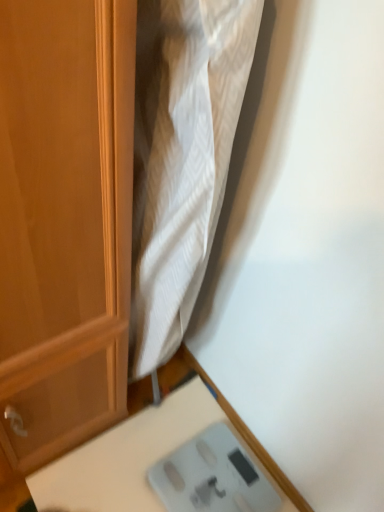
Question: From a real-world perspective, does white plastic scale at lower right sit lower than gray plastic scale at lower right?

Choices:
 (A) yes
 (B) no

Answer: (B)

Question: Is white plastic scale at lower right shorter than gray plastic scale at lower right?

Choices:
 (A) yes
 (B) no

Answer: (B)

Question: Can we say white plastic scale at lower right lies outside gray plastic scale at lower right?

Choices:
 (A) no
 (B) yes

Answer: (B)

Question: From the image's perspective, is white plastic scale at lower right located above gray plastic scale at lower right?

Choices:
 (A) yes
 (B) no

Answer: (B)

Question: Can you confirm if white plastic scale at lower right is wider than gray plastic scale at lower right?

Choices:
 (A) yes
 (B) no

Answer: (A)

Question: Considering the relative sizes of white plastic scale at lower right and gray plastic scale at lower right in the image provided, is white plastic scale at lower right thinner than gray plastic scale at lower right?

Choices:
 (A) yes
 (B) no

Answer: (B)

Question: Is gray plastic scale at lower right turned away from white plastic scale at lower right?

Choices:
 (A) yes
 (B) no

Answer: (A)

Question: Can you confirm if gray plastic scale at lower right is thinner than white plastic scale at lower right?

Choices:
 (A) no
 (B) yes

Answer: (B)

Question: Is gray plastic scale at lower right shorter than white plastic scale at lower right?

Choices:
 (A) no
 (B) yes

Answer: (B)

Question: Is gray plastic scale at lower right oriented towards white plastic scale at lower right?

Choices:
 (A) yes
 (B) no

Answer: (A)

Question: Would you say white plastic scale at lower right is part of gray plastic scale at lower right's contents?

Choices:
 (A) yes
 (B) no

Answer: (B)

Question: Is gray plastic scale at lower right taller than white plastic scale at lower right?

Choices:
 (A) yes
 (B) no

Answer: (B)

Question: Based on their sizes in the image, would you say white plastic scale at lower right is bigger or smaller than gray plastic scale at lower right?

Choices:
 (A) small
 (B) big

Answer: (B)